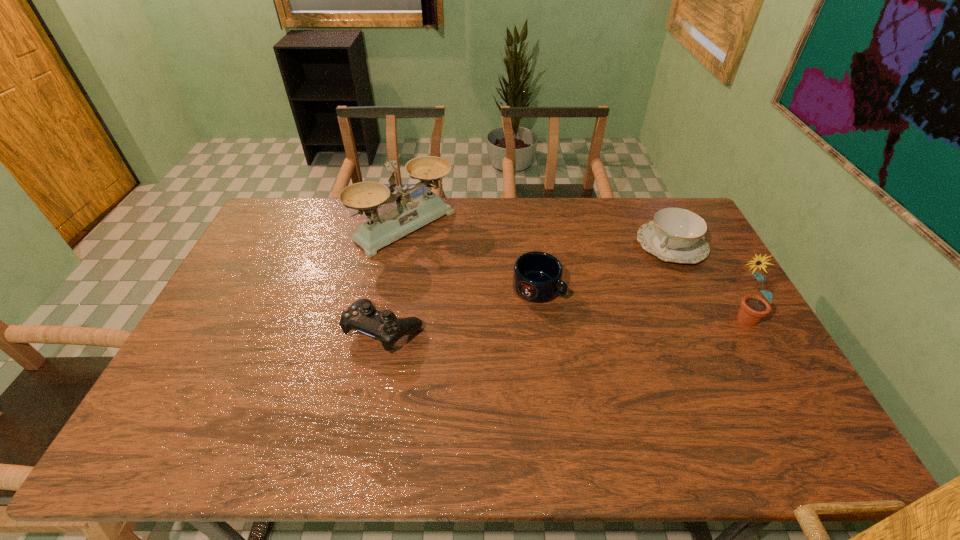
Locate an element on the screen. This screenshot has width=960, height=540. control is located at coordinates (x=362, y=316).

Locate an element on the screen. The image size is (960, 540). sunflower is located at coordinates (753, 308).

At what (x,y) coordinates should I click in order to perform the action: click on chinaware. Please return your answer as a coordinate pair (x, y). Looking at the image, I should click on (676, 235).

You are a GUI agent. You are given a task and a screenshot of the screen. Output one action in this format:
    pyautogui.click(x=<x>, y=<y>)
    Task: Click on the scale
    The width and height of the screenshot is (960, 540).
    Given the screenshot: What is the action you would take?
    pyautogui.click(x=409, y=215)

I want to click on the third object from right to left, so click(x=537, y=276).

Where is `free spot located on the left of the control`? Image resolution: width=960 pixels, height=540 pixels. free spot located on the left of the control is located at coordinates (279, 330).

Find the location of a particular element. This screenshot has width=960, height=540. free location located on the handle side of the chinaware is located at coordinates (600, 316).

The width and height of the screenshot is (960, 540). In order to click on vacant region located on the handle side of the chinaware in this screenshot , I will do `click(596, 320)`.

At what (x,y) coordinates should I click in order to perform the action: click on vacant space located on the handle side of the chinaware. Please return your answer as a coordinate pair (x, y). The height and width of the screenshot is (540, 960). Looking at the image, I should click on (633, 283).

Find the location of `free space located on the front-facing side of the scale`. free space located on the front-facing side of the scale is located at coordinates (510, 304).